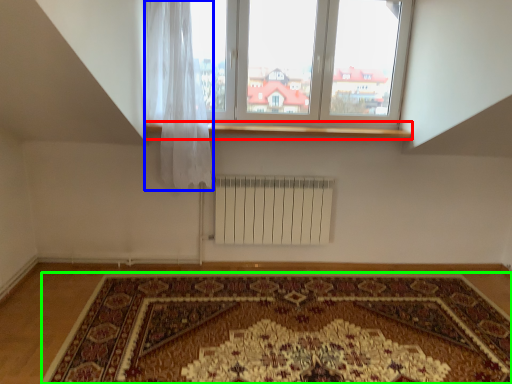
Question: Which is farther away from window sill (highlighted by a red box)? curtain (highlighted by a blue box) or mat (highlighted by a green box)?

Choices:
 (A) curtain
 (B) mat

Answer: (B)